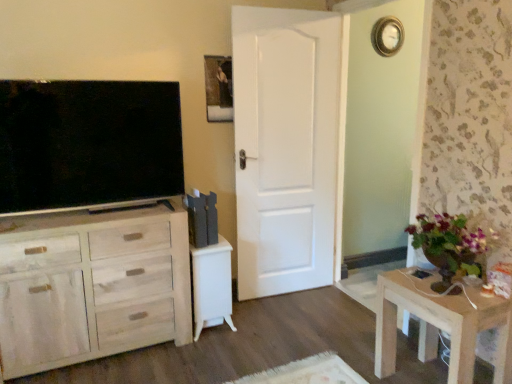
Question: Is white glossy vanity at center in front of or behind light wood cabinet at left in the image?

Choices:
 (A) front
 (B) behind

Answer: (B)

Question: Considering the positions of white glossy vanity at center and light wood cabinet at left in the image, is white glossy vanity at center taller or shorter than light wood cabinet at left?

Choices:
 (A) tall
 (B) short

Answer: (B)

Question: Which of these objects is positioned closest to the matte black tv at left?

Choices:
 (A) gold-toned metallic clock at upper right
 (B) light wood cabinet at left
 (C) wooden picture frame at upper center
 (D) white glossy vanity at center
 (E) white painted wood door at center

Answer: (B)

Question: Which of these objects is positioned closest to the wooden table at lower right?

Choices:
 (A) white painted wood door at center
 (B) light wood cabinet at left
 (C) gold-toned metallic clock at upper right
 (D) wooden picture frame at upper center
 (E) white glossy vanity at center

Answer: (E)